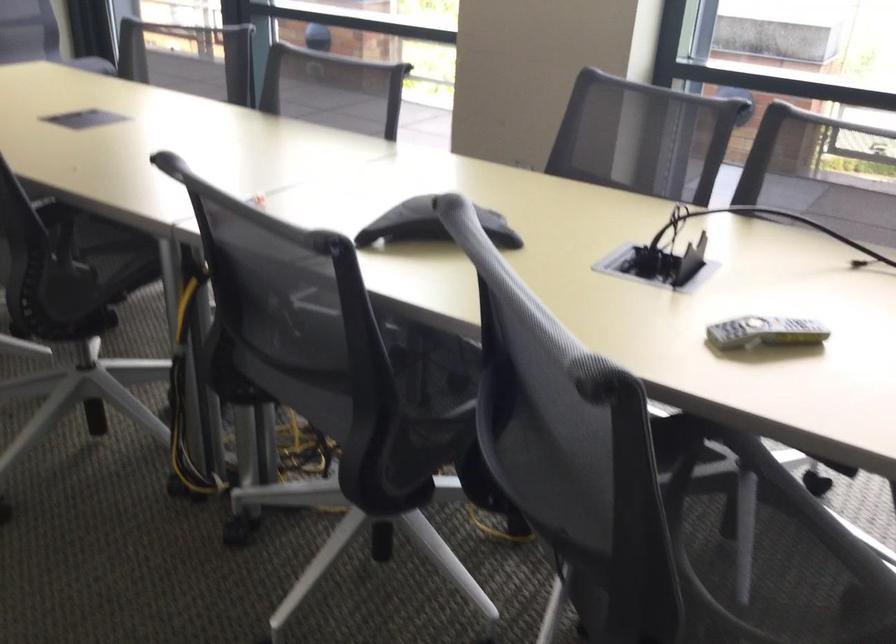
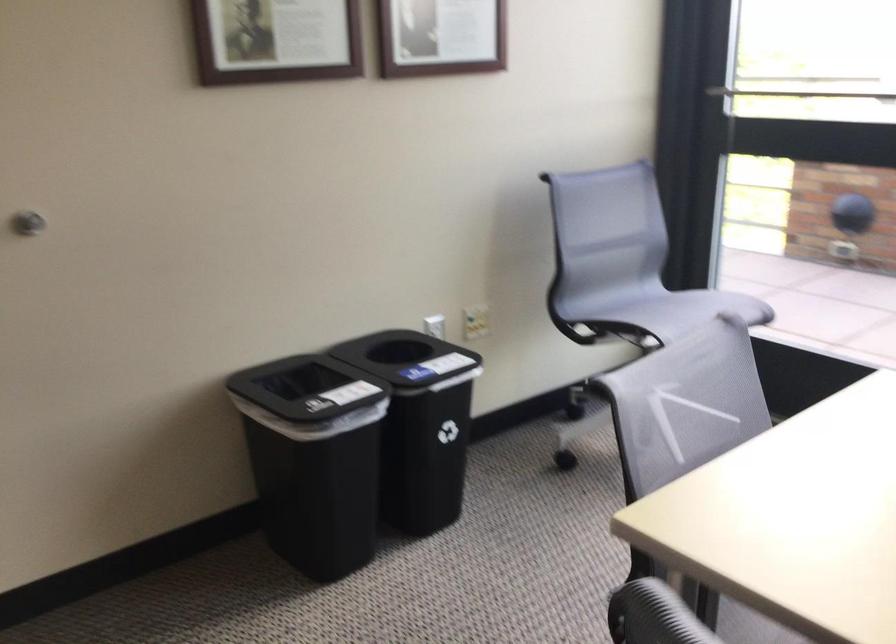
In a continuous first-person perspective shot, in which direction is the camera moving?

The cameraman walked toward left, forward.